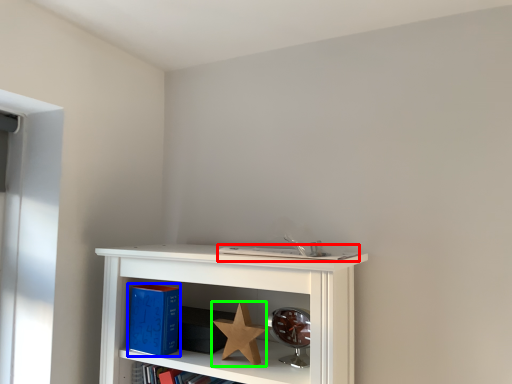
Question: Which is farther away from book (highlighted by a red box)? paperback book (highlighted by a blue box) or star (highlighted by a green box)?

Choices:
 (A) paperback book
 (B) star

Answer: (A)